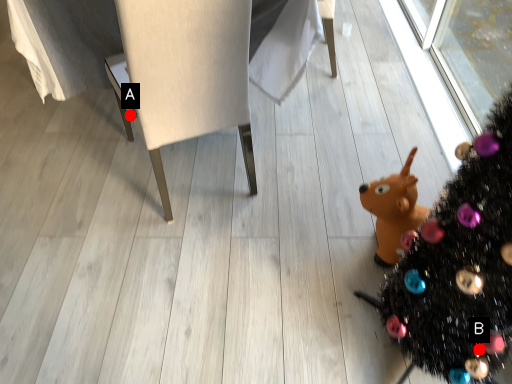
Question: Two points are circled on the image, labeled by A and B beside each circle. Which of the following is the closest to the observer?

Choices:
 (A) A is closer
 (B) B is closer

Answer: (B)